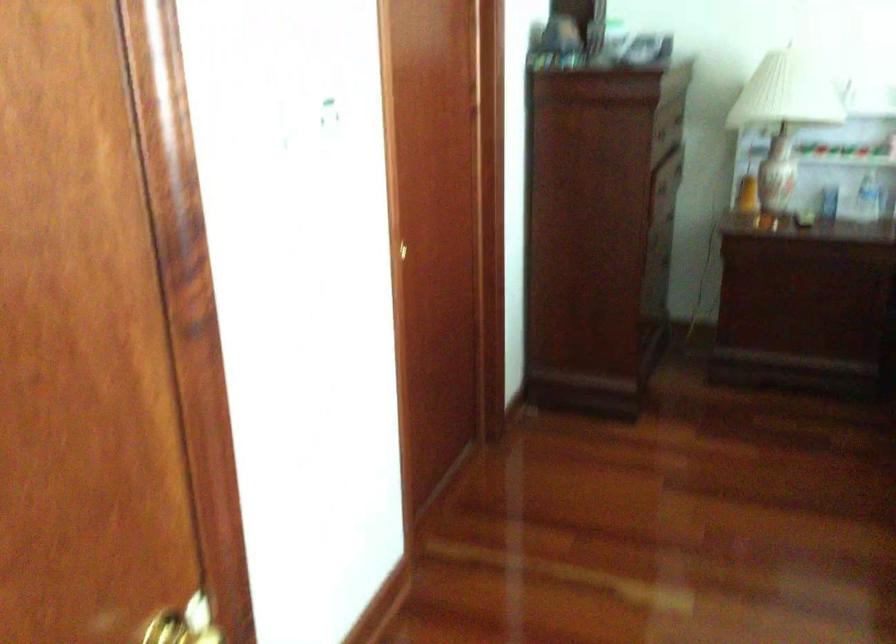
This screenshot has height=644, width=896. Describe the element at coordinates (408, 250) in the screenshot. I see `a door handle` at that location.